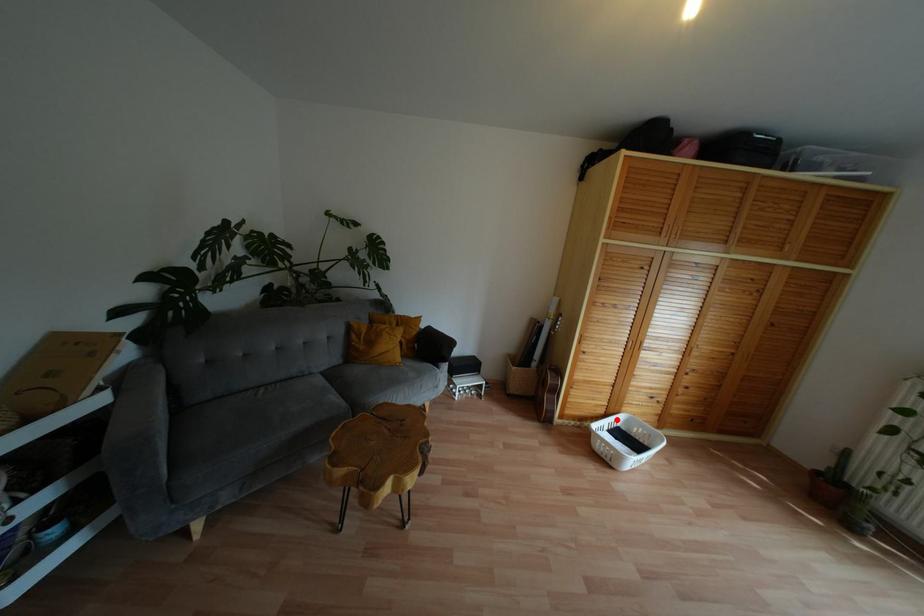
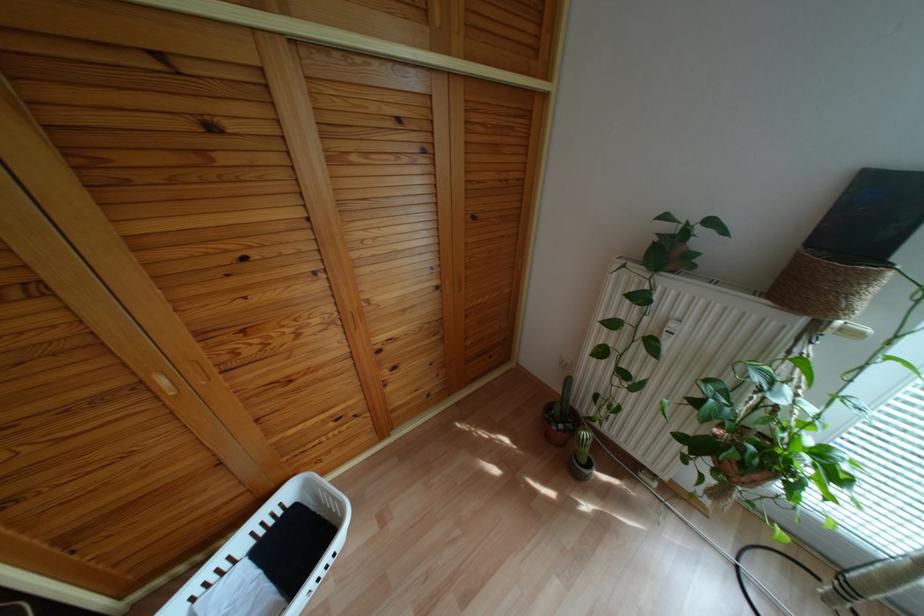
Question: I am providing you with two images of the same scene from different viewpoints. In image1, a red point is highlighted. Considering the same 3D point in image2, which of the following is correct?

Choices:
 (A) It is closer
 (B) It is farther

Answer: (A)